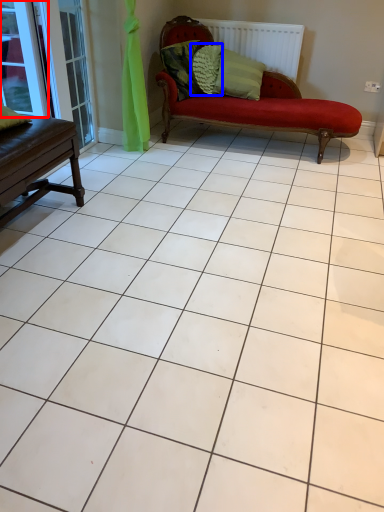
Question: Which of the following is the farthest to the observer, window (highlighted by a red box) or pillow (highlighted by a blue box)?

Choices:
 (A) window
 (B) pillow

Answer: (B)